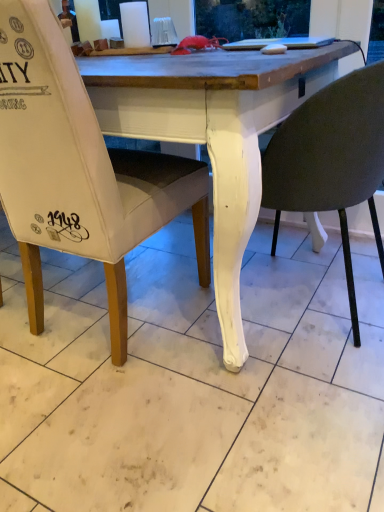
Locate an element on the screen. The height and width of the screenshot is (512, 384). vacant region below white matte chair at lower center, which appears as the 2th chair when viewed from the left (from a real-world perspective) is located at coordinates (302, 295).